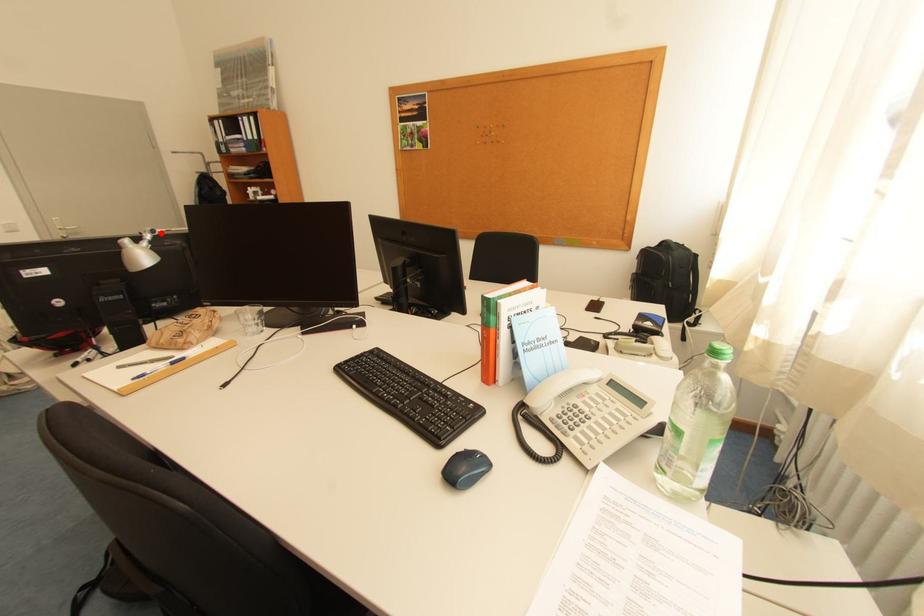
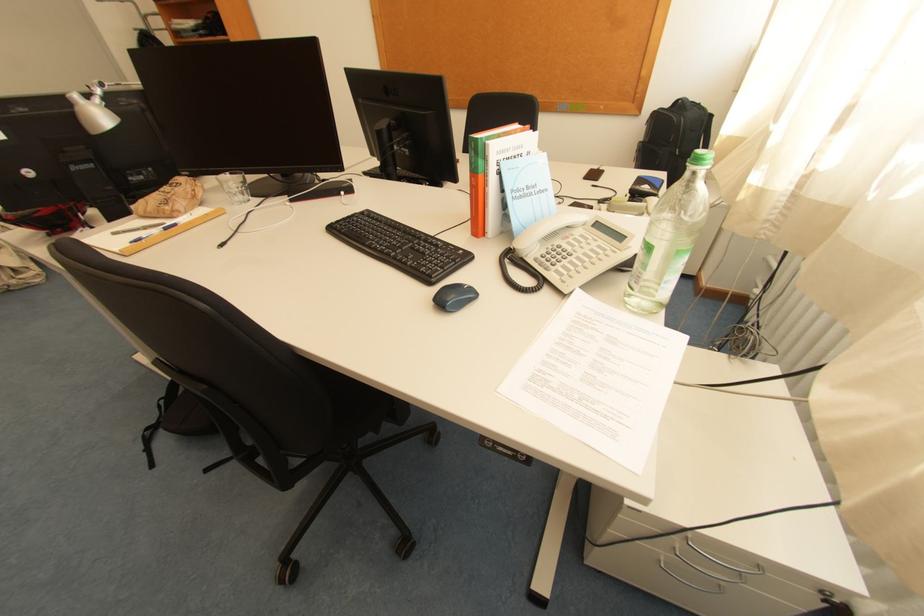
Question: I am providing you with two images of the same scene from different viewpoints. Image1 has a red point marked. In image2, the corresponding 3D location appears at what relative position? Reply with the corresponding letter.

Choices:
 (A) Closer
 (B) Farther

Answer: (B)